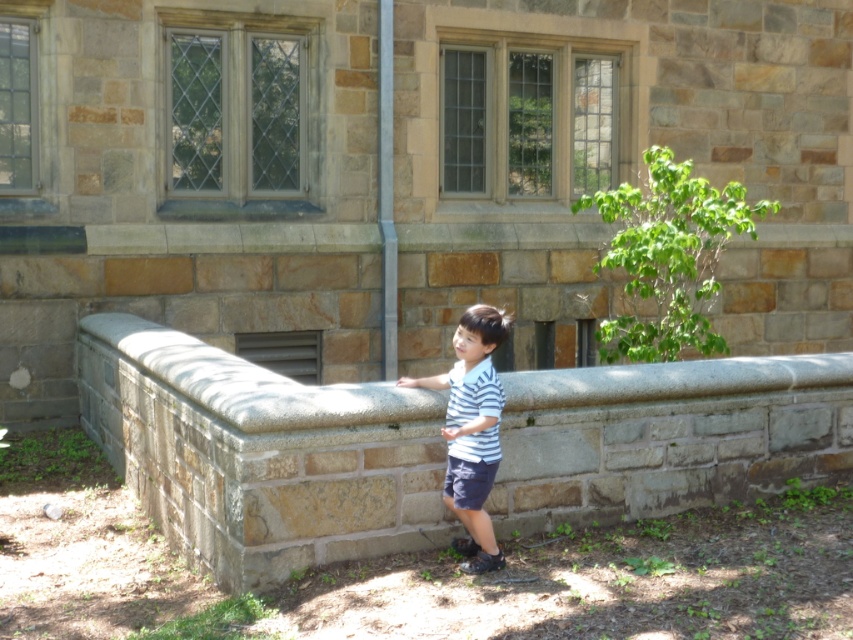
Can you confirm if gray stone ledge at center is wider than striped cotton shirt at center?

Indeed, gray stone ledge at center has a greater width compared to striped cotton shirt at center.

Identify the location of gray stone ledge at center. (260, 454).

Where is `gray stone ledge at center`? The width and height of the screenshot is (853, 640). gray stone ledge at center is located at coordinates (260, 454).